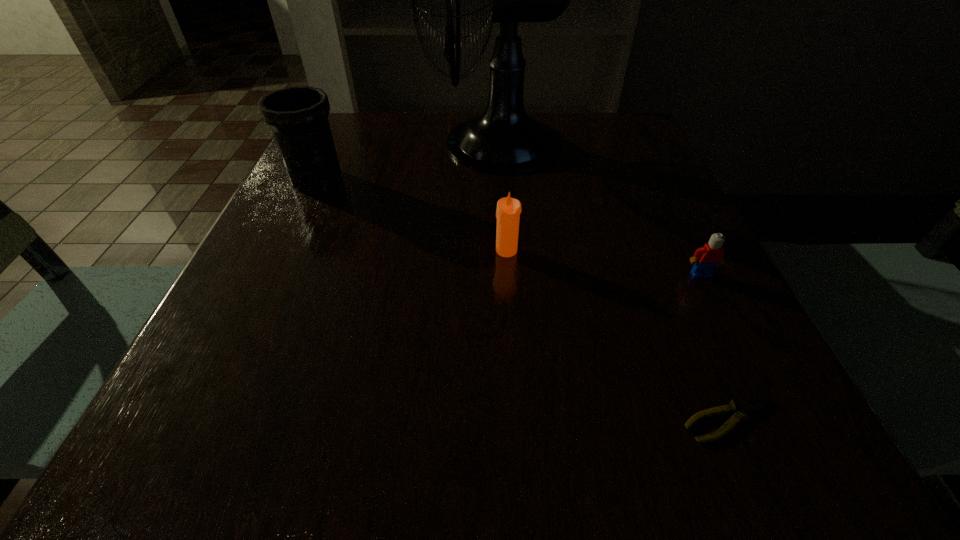
What are the coordinates of `vacant space situated on the front-facing side of the fan` in the screenshot? It's located at (327, 144).

Image resolution: width=960 pixels, height=540 pixels. In order to click on free location located on the front-facing side of the fan in this screenshot , I will do `click(336, 144)`.

You are a GUI agent. You are given a task and a screenshot of the screen. Output one action in this format:
    pyautogui.click(x=<x>, y=<y>)
    Task: Click on the vacant area situated on the back of the leftmost object
    The image size is (960, 540).
    Given the screenshot: What is the action you would take?
    pyautogui.click(x=348, y=113)

At what (x,y) coordinates should I click in order to perform the action: click on vacant space situated 0.190m on the right of the third farthest object. Please return your answer as a coordinate pair (x, y). This screenshot has width=960, height=540. Looking at the image, I should click on (629, 251).

The image size is (960, 540). I want to click on vacant space located 0.220m on the face of the second shortest object, so click(x=765, y=401).

At what (x,y) coordinates should I click in order to perform the action: click on vacant space located on the left of the pliers. Please return your answer as a coordinate pair (x, y). Looking at the image, I should click on (559, 420).

This screenshot has height=540, width=960. Identify the location of object located at the far edge. (504, 139).

Where is `object situated at the near edge`? object situated at the near edge is located at coordinates (745, 406).

At what (x,y) coordinates should I click in order to perform the action: click on object that is positioned at the left edge. Please return your answer as a coordinate pair (x, y). Looking at the image, I should click on (298, 116).

You are a GUI agent. You are given a task and a screenshot of the screen. Output one action in this format:
    pyautogui.click(x=<x>, y=<y>)
    Task: Click on the Lego that is at the right edge
    Image resolution: width=960 pixels, height=540 pixels.
    Given the screenshot: What is the action you would take?
    pyautogui.click(x=706, y=258)